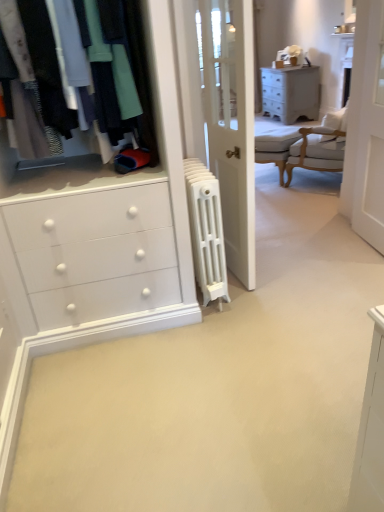
Question: Does matte gray chest of drawers at upper right have a greater height compared to white upholstered chair at upper right?

Choices:
 (A) yes
 (B) no

Answer: (B)

Question: Is matte gray chest of drawers at upper right bigger than white upholstered chair at upper right?

Choices:
 (A) no
 (B) yes

Answer: (B)

Question: Are matte gray chest of drawers at upper right and white upholstered chair at upper right located far from each other?

Choices:
 (A) yes
 (B) no

Answer: (A)

Question: Considering the relative sizes of matte gray chest of drawers at upper right and white upholstered chair at upper right in the image provided, is matte gray chest of drawers at upper right shorter than white upholstered chair at upper right?

Choices:
 (A) no
 (B) yes

Answer: (B)

Question: Can you confirm if matte gray chest of drawers at upper right is positioned to the right of white upholstered chair at upper right?

Choices:
 (A) yes
 (B) no

Answer: (A)

Question: Does matte gray chest of drawers at upper right lie behind white upholstered chair at upper right?

Choices:
 (A) yes
 (B) no

Answer: (A)

Question: From a real-world perspective, is light gray fabric armchair at center under white cast iron radiator at center?

Choices:
 (A) no
 (B) yes

Answer: (B)

Question: Considering the relative sizes of light gray fabric armchair at center and white cast iron radiator at center in the image provided, is light gray fabric armchair at center wider than white cast iron radiator at center?

Choices:
 (A) no
 (B) yes

Answer: (A)

Question: Is white cast iron radiator at center at the back of light gray fabric armchair at center?

Choices:
 (A) yes
 (B) no

Answer: (B)

Question: Could you tell me if light gray fabric armchair at center is facing white cast iron radiator at center?

Choices:
 (A) yes
 (B) no

Answer: (B)

Question: Can you confirm if light gray fabric armchair at center is taller than white cast iron radiator at center?

Choices:
 (A) no
 (B) yes

Answer: (A)

Question: Does light gray fabric armchair at center have a lesser height compared to white cast iron radiator at center?

Choices:
 (A) no
 (B) yes

Answer: (B)

Question: Is matte black clothing at upper left bigger than white wood screen door at upper right?

Choices:
 (A) yes
 (B) no

Answer: (A)